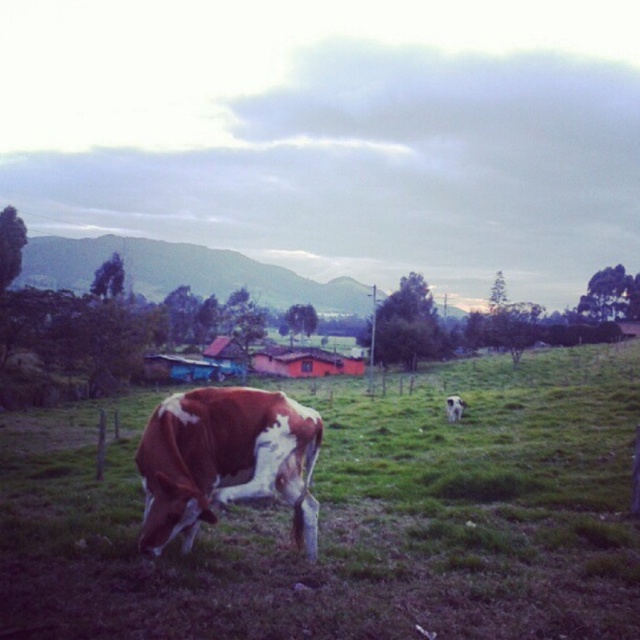
You are a farmer who needs to separate the two cows in the field. The minimum distance required between them for proper grazing is 5 meters. Based on the image, can you confirm if the current distance between the brown speckled cow at lower left and the other cow allows for proper grazing?

The two cows are 4.78 meters apart, which is less than the required 5 meters for proper grazing. Therefore, the current distance does not allow for proper grazing.

You are standing in the field looking at the brown speckled cow at lower left and the white fur at center. Which cow is nearer to you?

The brown speckled cow at lower left is closer to the viewer than the white fur at center.

You are a farmer checking the field. You notice the brown speckled cow at lower left and the white fur at center. Which animal is bigger in width?

The brown speckled cow at lower left is larger in width than the white fur at center.